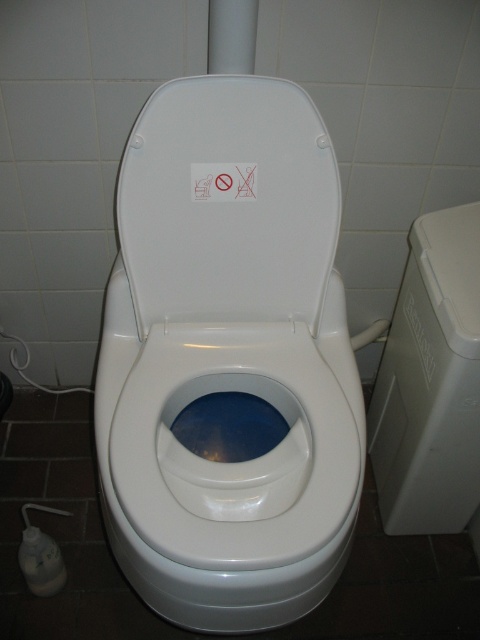
You are trying to place a decorative item on the white glossy toilet lid at center. The item is as wide as the white plastic trash can at right. Will it fit?

The white glossy toilet lid at center might be wider than white plastic trash can at right, so the decorative item might fit if it matches the width of the trash can.

You are designing a layout for a small restroom and need to place the white glossy toilet lid at center and the white plastic trash can at right. Given their sizes, which object should be placed closer to the wall to save space?

The white glossy toilet lid at center occupies less space than the white plastic trash can at right, so placing the larger white plastic trash can at right closer to the wall would allow the smaller toilet lid to be positioned more centrally without taking up too much space.

You are a guest in this restroom and need to dispose of a used tissue. You see a white glossy toilet lid at center and a white plastic trash can at right. Which one should you use for the tissue?

The white plastic trash can at right is the correct disposal for used tissues, as the white glossy toilet lid at center is part of the toilet bowl containing blue liquid, which may be a composting system not designed for flushing paper.